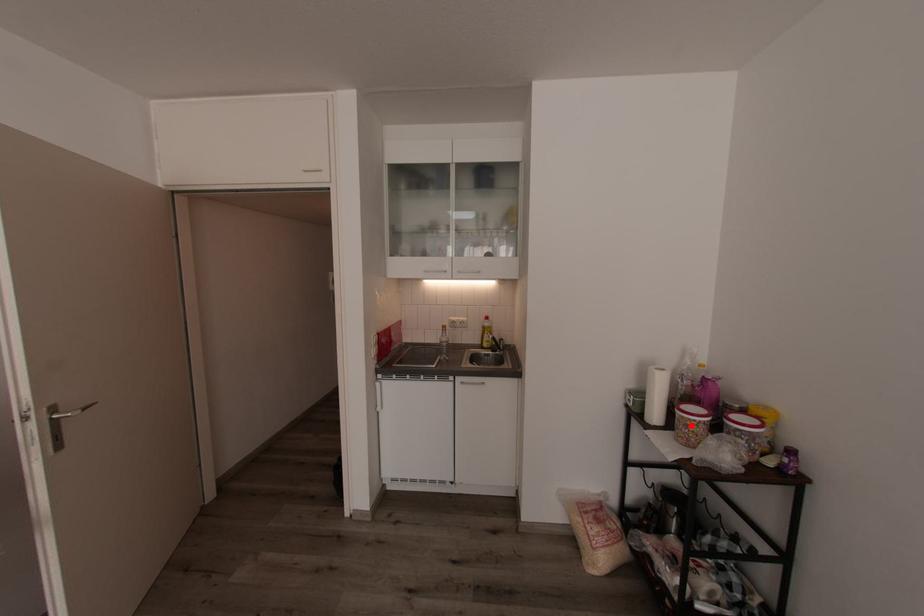
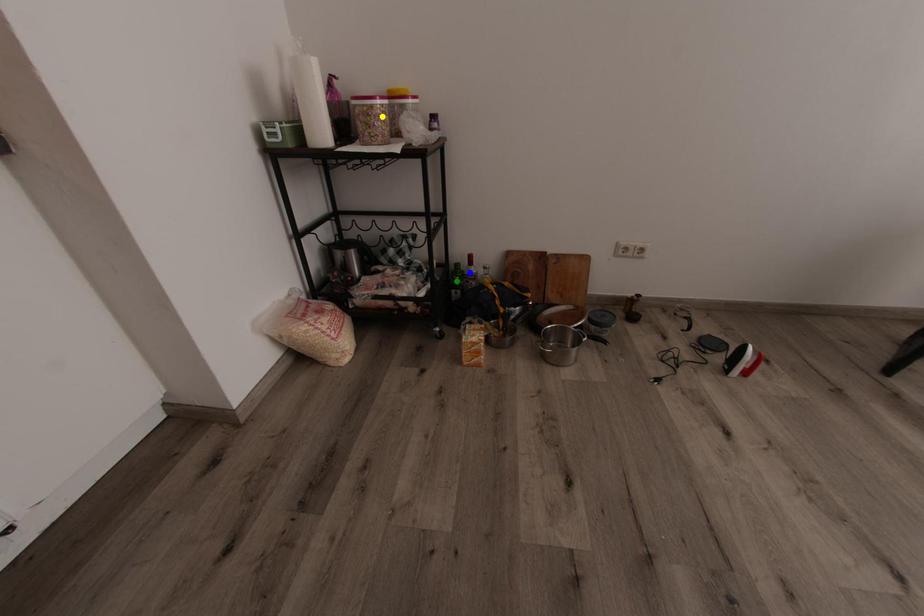
Question: I am providing you with two images of the same scene from different viewpoints. A red point is marked on the first image. You are given multiple points on the second image. Can you choose the point in image 2 that corresponds to the point in image 1?

Choices:
 (A) green point
 (B) blue point
 (C) yellow point

Answer: (C)